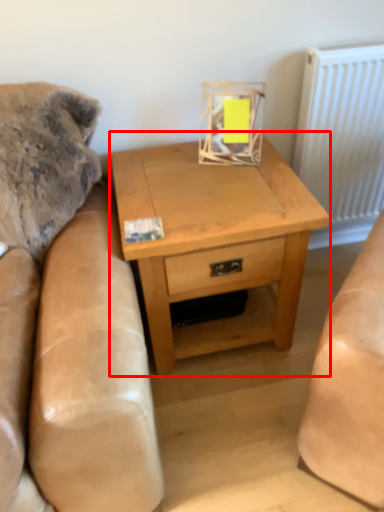
Question: From the image's perspective, what is the correct spatial relationship of nightstand (annotated by the red box) in relation to radiator?

Choices:
 (A) above
 (B) below

Answer: (B)